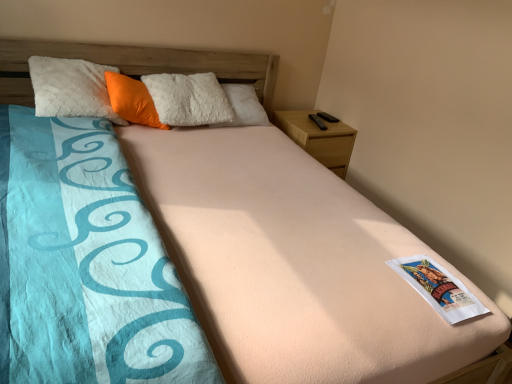
Question: In terms of size, does orange plush pillow at upper left appear bigger or smaller than wooden nightstand at upper right?

Choices:
 (A) small
 (B) big

Answer: (A)

Question: Choose the correct answer: Is orange plush pillow at upper left inside wooden nightstand at upper right or outside it?

Choices:
 (A) outside
 (B) inside

Answer: (A)

Question: Estimate the real-world distances between objects in this image. Which object is closer to the white paper at center?

Choices:
 (A) wooden nightstand at upper right
 (B) orange plush pillow at upper left

Answer: (A)

Question: Which object is positioned closest to the wooden nightstand at upper right?

Choices:
 (A) orange plush pillow at upper left
 (B) white paper at center

Answer: (A)